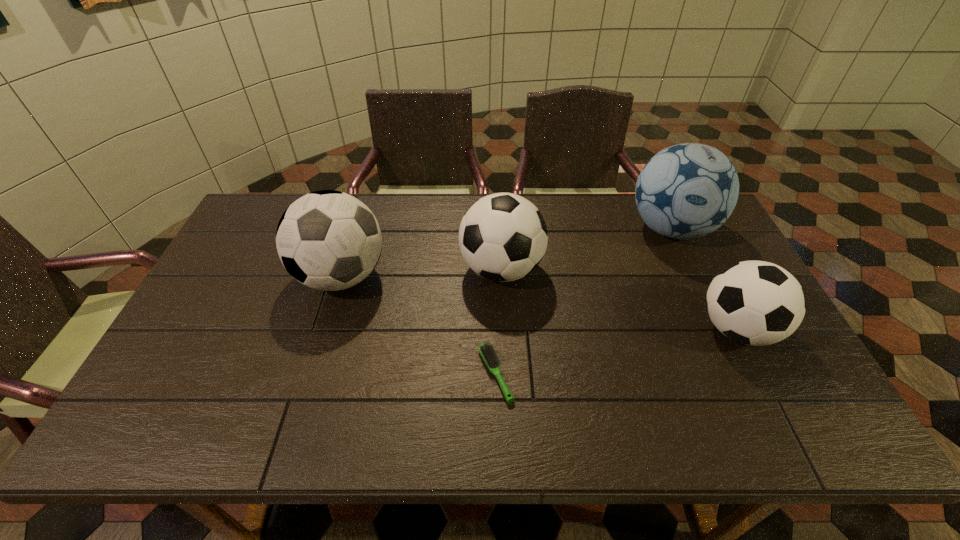
Find the location of a particular element. Image resolution: width=960 pixels, height=540 pixels. the third closest object to the third soccer ball from right to left is located at coordinates (686, 191).

Locate an element on the screen. soccer ball object that ranks as the second closest to the second shortest object is located at coordinates (503, 237).

I want to click on soccer ball that is the fourth closest to the hairbrush, so click(686, 191).

Locate an element on the screen. The image size is (960, 540). free space that satisfies the following two spatial constraints: 1. on the back side of the shortest object; 2. on the left side of the second soccer ball from left to right is located at coordinates [x=492, y=269].

What are the coordinates of `vacant area in the image that satisfies the following two spatial constraints: 1. on the main logo of the second shortest object; 2. on the left side of the leftmost soccer ball` in the screenshot? It's located at (325, 329).